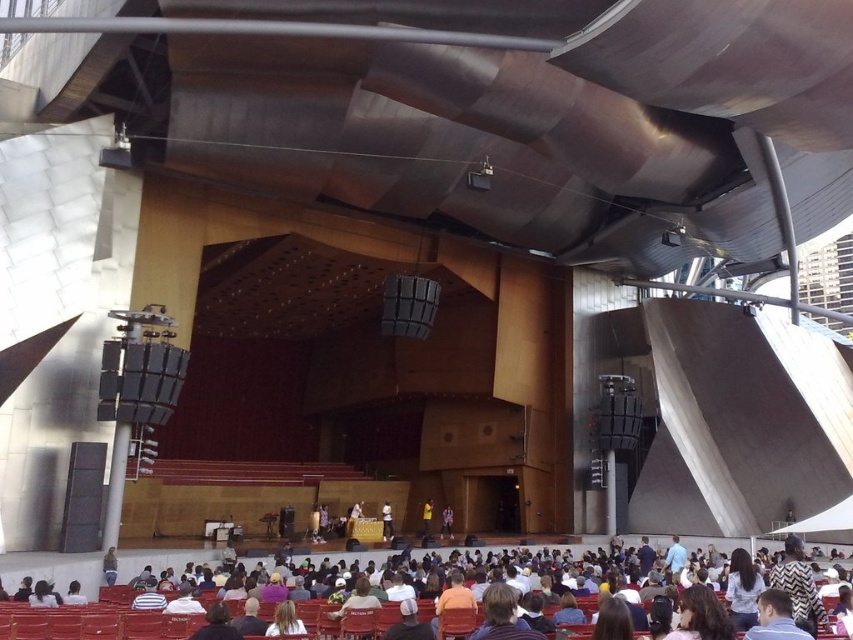
You are a performer preparing to walk from the yellow fabric at stage center to the matte red seats at lower center during a dramatic entrance. How far will you have to walk?

The distance between the matte red seats at lower center and the yellow fabric at stage center is 15.88 meters, so you will have to walk approximately 15.88 meters.

You are attending an outdoor concert and want to find your seat. The venue map shows your seat is at point (534, 589). Based on the image, where would you find your seat?

Your seat is located at the matte red seats at lower center, which corresponds to point (534, 589).